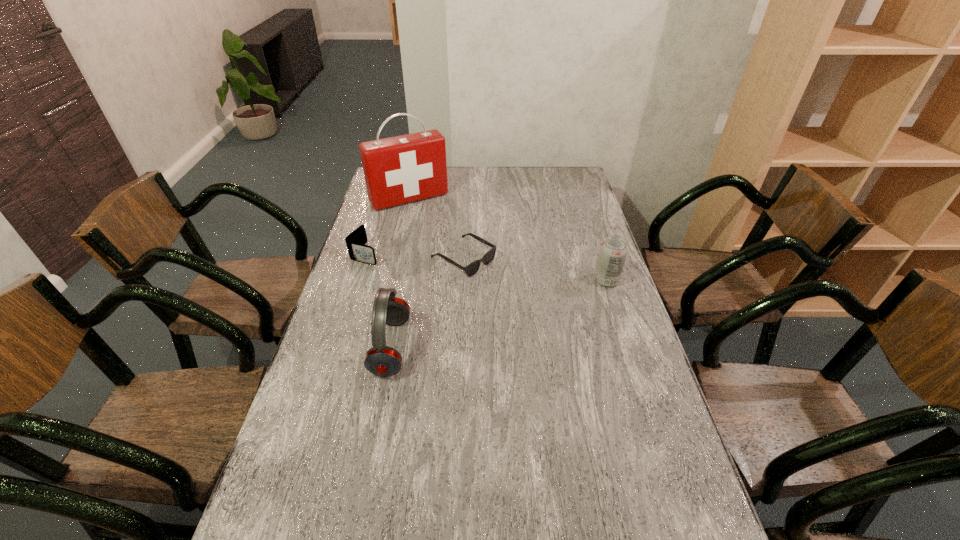
At what (x,y) coordinates should I click in order to perform the action: click on vacant space on the desktop that is between the earphone and the soda can and is positioned at the front lenses of the shortest object. Please return your answer as a coordinate pair (x, y). This screenshot has height=540, width=960. Looking at the image, I should click on (539, 301).

What are the coordinates of `vacant space on the desktop that is between the second tallest object and the third shortest object and is positioned on the outer surface of the fourth tallest object` in the screenshot? It's located at (538, 302).

The width and height of the screenshot is (960, 540). I want to click on free space on the desktop that is between the nearest object and the third tallest object and is positioned on the front face of the farthest object, so click(490, 316).